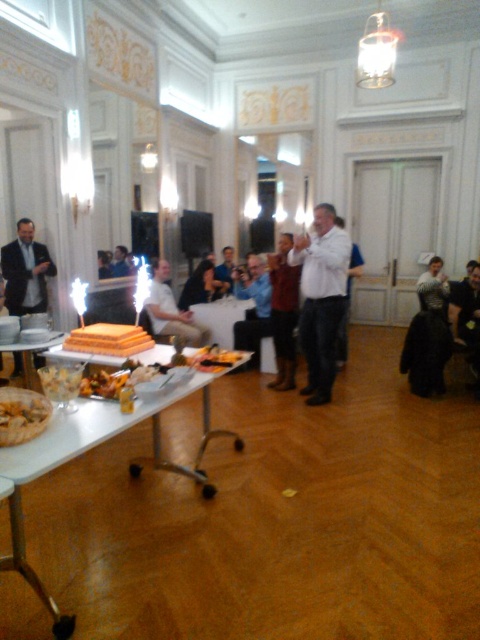
Question: Does white glossy table at center appear on the right side of white glossy table at lower left?

Choices:
 (A) no
 (B) yes

Answer: (B)

Question: Is white plastic table at lower left to the right of white shirt at center from the viewer's perspective?

Choices:
 (A) yes
 (B) no

Answer: (B)

Question: Which object is positioned farthest from the light blue shirt at center?

Choices:
 (A) white glossy table at center
 (B) light brown leather jacket at center
 (C) white shirt at center

Answer: (C)

Question: Is white plastic table at lower left below translucent glass bowl at lower left?

Choices:
 (A) no
 (B) yes

Answer: (B)

Question: Among these objects, which one is nearest to the camera?

Choices:
 (A) leather jacket at center
 (B) white shirt at center

Answer: (B)

Question: Which object is positioned closest to the white glossy table at lower left?

Choices:
 (A) matte black suit at left
 (B) translucent glass bowl at lower left
 (C) white plastic table at lower left

Answer: (A)